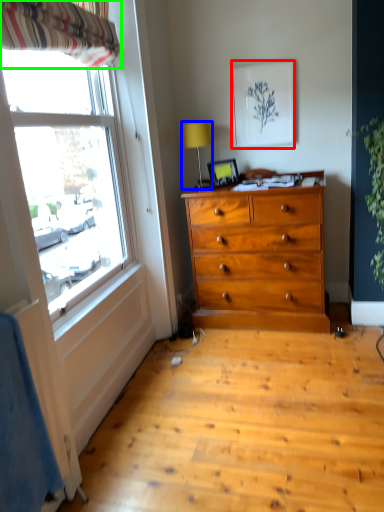
Question: Which is nearer to the picture frame (highlighted by a red box)? lamp (highlighted by a blue box) or curtain (highlighted by a green box).

Choices:
 (A) lamp
 (B) curtain

Answer: (A)